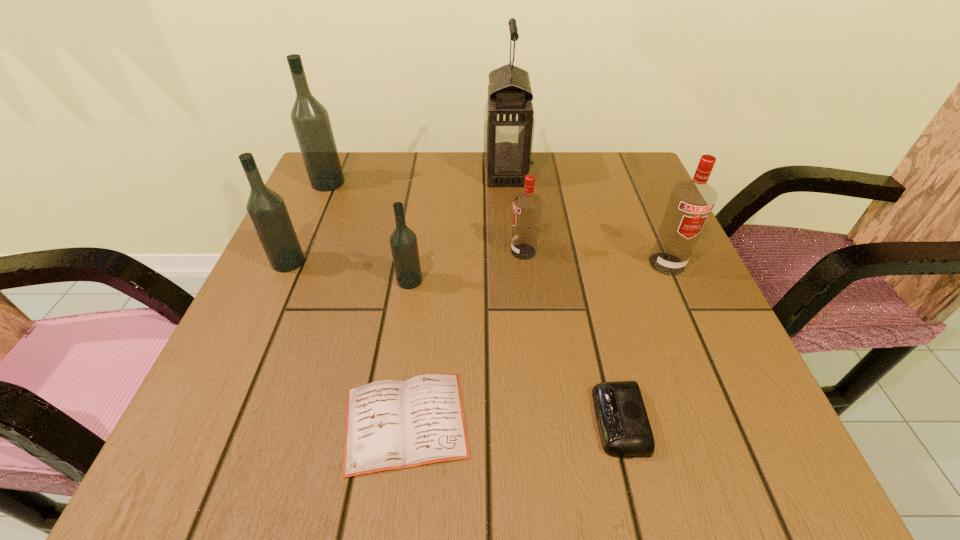
The image size is (960, 540). Find the location of `alarm clock that is positioned at the near edge`. alarm clock that is positioned at the near edge is located at coordinates (623, 424).

The width and height of the screenshot is (960, 540). Identify the location of diary present at the near edge. (390, 424).

Identify the location of object located in the right edge section of the desktop. (691, 202).

This screenshot has width=960, height=540. Find the location of `object present at the far left corner`. object present at the far left corner is located at coordinates (310, 119).

The height and width of the screenshot is (540, 960). In order to click on free spot at the far edge of the desktop in this screenshot , I will do `click(541, 157)`.

This screenshot has height=540, width=960. I want to click on vacant space at the near edge of the desktop, so click(x=293, y=468).

Locate an element on the screen. Image resolution: width=960 pixels, height=540 pixels. vacant space at the left edge of the desktop is located at coordinates (328, 255).

At what (x,y) coordinates should I click in order to perform the action: click on free space at the right edge of the desktop. Please return your answer as a coordinate pair (x, y). The height and width of the screenshot is (540, 960). Looking at the image, I should click on (646, 338).

Where is `free location at the far left corner`? Image resolution: width=960 pixels, height=540 pixels. free location at the far left corner is located at coordinates (353, 204).

Identify the location of free space at the near left corner. coord(259,468).